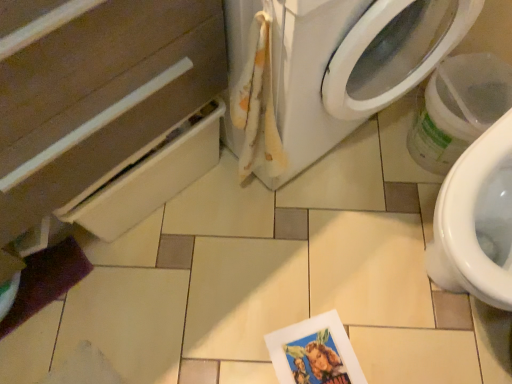
The height and width of the screenshot is (384, 512). I want to click on vacant space underneath printed paper postcard at lower center (from a real-world perspective), so click(327, 355).